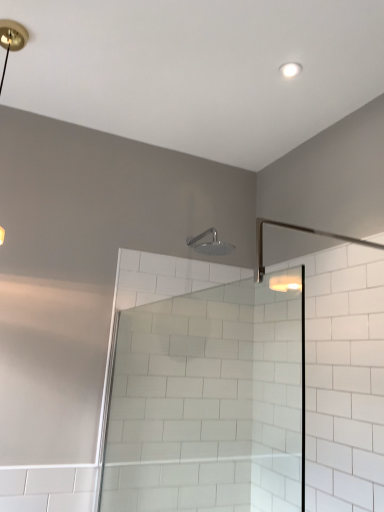
Question: In the image, is matte gold light fixture at upper left positioned in front of or behind clear glass shower door at center?

Choices:
 (A) front
 (B) behind

Answer: (B)

Question: From a real-world perspective, is matte gold light fixture at upper left positioned above or below clear glass shower door at center?

Choices:
 (A) above
 (B) below

Answer: (A)

Question: Which object is the closest to the satin nickel shower head at upper center?

Choices:
 (A) matte gold light fixture at upper left
 (B) clear glass shower door at center

Answer: (B)

Question: Which object is the closest to the matte gold light fixture at upper left?

Choices:
 (A) satin nickel shower head at upper center
 (B) clear glass shower door at center

Answer: (A)